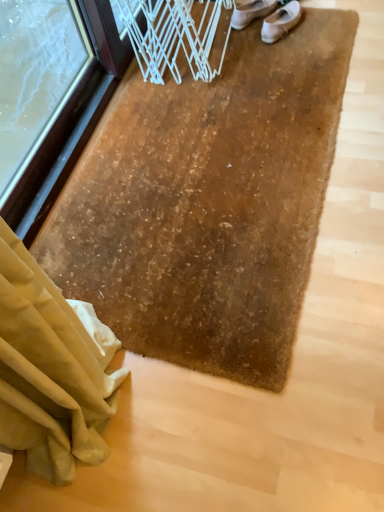
Question: Which direction should I rotate to look at white leather shoe at upper center, the first footwear from the left?

Choices:
 (A) left
 (B) right

Answer: (B)

Question: From the image's perspective, would you say white leather shoe at upper center, placed as the second footwear when sorted from right to left, is shown under white leather shoes at upper center, the second footwear positioned from the left?

Choices:
 (A) no
 (B) yes

Answer: (A)

Question: Is white leather shoe at upper center, the first footwear from the left, taller than white leather shoes at upper center, which is the 1th footwear in right-to-left order?

Choices:
 (A) yes
 (B) no

Answer: (A)

Question: Is white leather shoe at upper center, placed as the second footwear when sorted from right to left, facing away from white leather shoes at upper center, which is the 1th footwear in right-to-left order?

Choices:
 (A) no
 (B) yes

Answer: (B)

Question: Considering the relative positions of white leather shoe at upper center, placed as the second footwear when sorted from right to left, and white leather shoes at upper center, which is the 1th footwear in right-to-left order, in the image provided, is white leather shoe at upper center, placed as the second footwear when sorted from right to left, in front of white leather shoes at upper center, which is the 1th footwear in right-to-left order,?

Choices:
 (A) yes
 (B) no

Answer: (B)

Question: Is white leather shoe at upper center, placed as the second footwear when sorted from right to left, positioned far away from white leather shoes at upper center, which is the 1th footwear in right-to-left order?

Choices:
 (A) no
 (B) yes

Answer: (A)

Question: Is white leather shoe at upper center, placed as the second footwear when sorted from right to left, positioned beyond the bounds of white leather shoes at upper center, which is the 1th footwear in right-to-left order?

Choices:
 (A) yes
 (B) no

Answer: (A)

Question: Considering the relative positions of white leather shoes at upper center, the second footwear positioned from the left, and white leather shoe at upper center, the first footwear from the left, in the image provided, is white leather shoes at upper center, the second footwear positioned from the left, to the right of white leather shoe at upper center, the first footwear from the left, from the viewer's perspective?

Choices:
 (A) yes
 (B) no

Answer: (A)

Question: Does white leather shoes at upper center, which is the 1th footwear in right-to-left order, have a smaller size compared to white leather shoe at upper center, placed as the second footwear when sorted from right to left?

Choices:
 (A) no
 (B) yes

Answer: (A)

Question: Does white leather shoes at upper center, which is the 1th footwear in right-to-left order, have a greater height compared to white leather shoe at upper center, the first footwear from the left?

Choices:
 (A) no
 (B) yes

Answer: (A)

Question: Can you confirm if white leather shoes at upper center, which is the 1th footwear in right-to-left order, is positioned to the left of white leather shoe at upper center, the first footwear from the left?

Choices:
 (A) no
 (B) yes

Answer: (A)

Question: Considering the relative sizes of white leather shoes at upper center, the second footwear positioned from the left, and white leather shoe at upper center, placed as the second footwear when sorted from right to left, in the image provided, is white leather shoes at upper center, the second footwear positioned from the left, bigger than white leather shoe at upper center, placed as the second footwear when sorted from right to left,?

Choices:
 (A) yes
 (B) no

Answer: (A)

Question: Is white leather shoes at upper center, the second footwear positioned from the left, beside white leather shoe at upper center, the first footwear from the left?

Choices:
 (A) yes
 (B) no

Answer: (A)

Question: Considering the positions of white leather shoe at upper center, placed as the second footwear when sorted from right to left, and white leather shoes at upper center, which is the 1th footwear in right-to-left order, in the image, is white leather shoe at upper center, placed as the second footwear when sorted from right to left, wider or thinner than white leather shoes at upper center, which is the 1th footwear in right-to-left order,?

Choices:
 (A) wide
 (B) thin

Answer: (B)